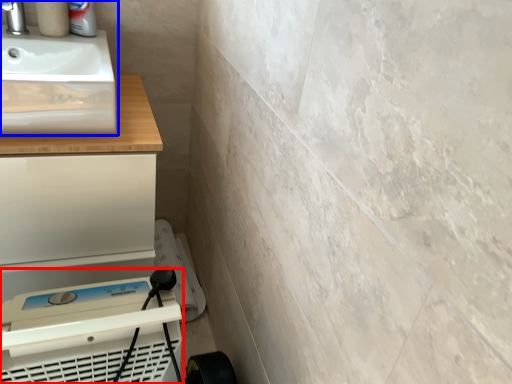
Question: Among these objects, which one is farthest to the camera, appliance (highlighted by a red box) or sink (highlighted by a blue box)?

Choices:
 (A) appliance
 (B) sink

Answer: (B)